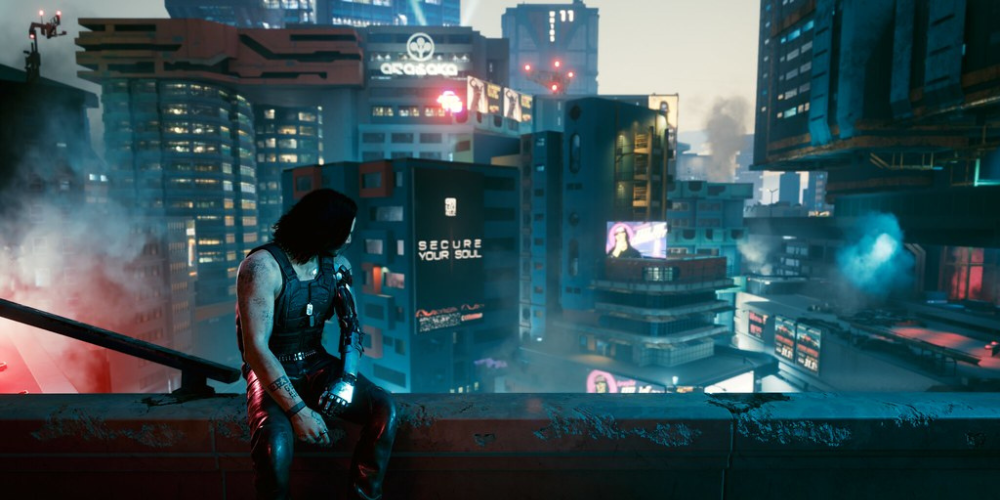
Identify the location of windows. (649, 274), (288, 158), (197, 143), (397, 284).